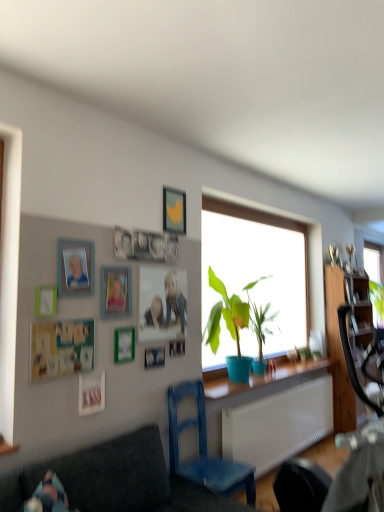
Question: Is wooden cabinet at right not inside wooden rocking chair at lower right?

Choices:
 (A) no
 (B) yes

Answer: (B)

Question: From the image's perspective, is wooden cabinet at right located beneath wooden rocking chair at lower right?

Choices:
 (A) no
 (B) yes

Answer: (B)

Question: From a real-world perspective, is wooden cabinet at right beneath wooden rocking chair at lower right?

Choices:
 (A) yes
 (B) no

Answer: (B)

Question: Is wooden cabinet at right smaller than wooden rocking chair at lower right?

Choices:
 (A) no
 (B) yes

Answer: (A)

Question: Is wooden rocking chair at lower right completely or partially inside wooden cabinet at right?

Choices:
 (A) no
 (B) yes

Answer: (A)

Question: Is wooden cabinet at right aimed at wooden rocking chair at lower right?

Choices:
 (A) yes
 (B) no

Answer: (B)

Question: Is teal matte board at lower left, the fifth picture frame positioned from the bottom, further to the viewer compared to matte blue pot at center?

Choices:
 (A) yes
 (B) no

Answer: (B)

Question: Considering the relative sizes of teal matte board at lower left, the fifth picture frame positioned from the bottom, and matte blue pot at center in the image provided, is teal matte board at lower left, the fifth picture frame positioned from the bottom, bigger than matte blue pot at center?

Choices:
 (A) no
 (B) yes

Answer: (A)

Question: Considering the relative sizes of teal matte board at lower left, the fifth picture frame positioned from the bottom, and matte blue pot at center in the image provided, is teal matte board at lower left, the fifth picture frame positioned from the bottom, smaller than matte blue pot at center?

Choices:
 (A) yes
 (B) no

Answer: (A)

Question: Is teal matte board at lower left, which is counted as the sixth picture frame, starting from the top, far away from matte blue pot at center?

Choices:
 (A) yes
 (B) no

Answer: (A)

Question: Is teal matte board at lower left, the fifth picture frame positioned from the bottom, to the left of matte blue pot at center from the viewer's perspective?

Choices:
 (A) no
 (B) yes

Answer: (B)

Question: Can matte blue pot at center be found inside teal matte board at lower left, the fifth picture frame positioned from the bottom?

Choices:
 (A) yes
 (B) no

Answer: (B)

Question: Is the depth of wooden rocking chair at lower right greater than that of matte plastic picture frame at upper left, the 9th picture frame positioned from the bottom?

Choices:
 (A) yes
 (B) no

Answer: (B)